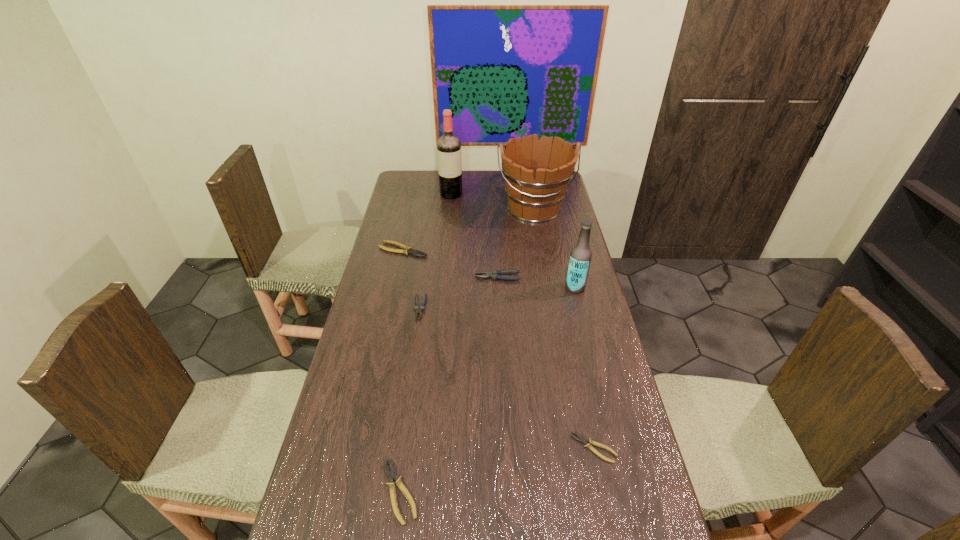
Identify the location of the tallest object. The image size is (960, 540). (448, 146).

Locate an element on the screen. The height and width of the screenshot is (540, 960). wine bucket is located at coordinates pos(537,173).

You are a GUI agent. You are given a task and a screenshot of the screen. Output one action in this format:
    pyautogui.click(x=<x>, y=<y>)
    Task: Click on the beer bottle
    The height and width of the screenshot is (540, 960).
    Given the screenshot: What is the action you would take?
    pyautogui.click(x=580, y=257)

Where is `the fourth tallest object`? the fourth tallest object is located at coordinates (495, 274).

In order to click on the tallest pliers in this screenshot , I will do pyautogui.click(x=495, y=274).

Locate an element on the screen. The image size is (960, 540). the farthest pliers is located at coordinates (406, 250).

The height and width of the screenshot is (540, 960). Find the location of `the biggest yellow pliers`. the biggest yellow pliers is located at coordinates (406, 250).

Identify the location of the nearer gray pliers. The width and height of the screenshot is (960, 540). (418, 310).

Where is `the smaller gray pliers`? the smaller gray pliers is located at coordinates (418, 310).

Locate an element on the screen. the second smallest yellow pliers is located at coordinates (391, 474).